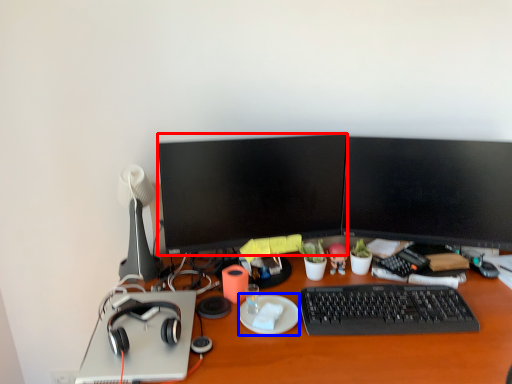
Question: Which object is closer to the camera taking this photo, television (highlighted by a red box) or plate (highlighted by a blue box)?

Choices:
 (A) television
 (B) plate

Answer: (B)